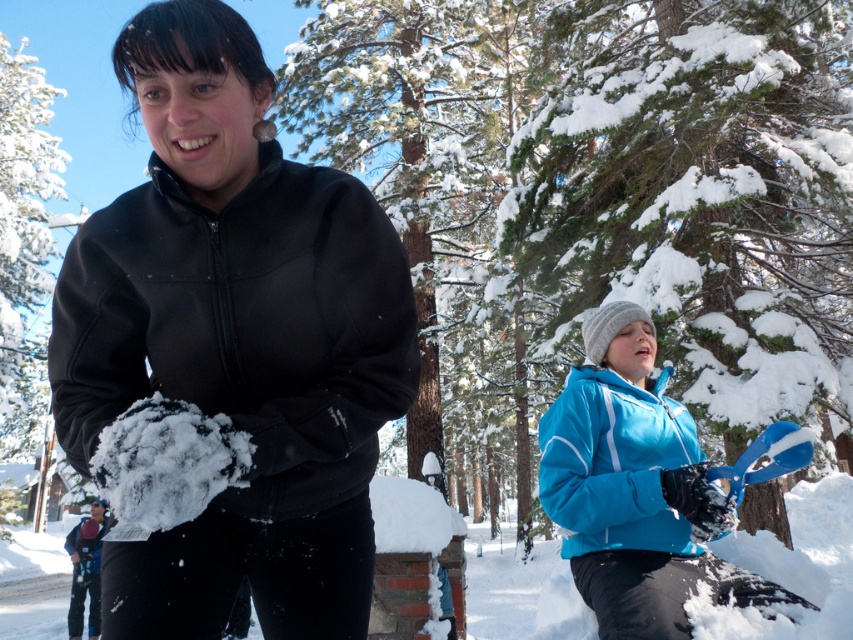
You are standing in the snowy scene and want to see both the blue matte jacket at lower right and the green textured pine tree at center. Can you see both at the same time without moving your head?

The blue matte jacket at lower right is behind the green textured pine tree at center, so you cannot see both at the same time without moving your head because the tree is blocking the view of the jacket.

You are standing in the snowy scene and want to move from the matte black jacket at center to the green textured pine tree at center. Which direction should you face to walk directly towards it?

You should face to the right to walk directly towards the green textured pine tree at center from the matte black jacket at center, since the green textured pine tree at center is located to the right of the matte black jacket at center according to the description.